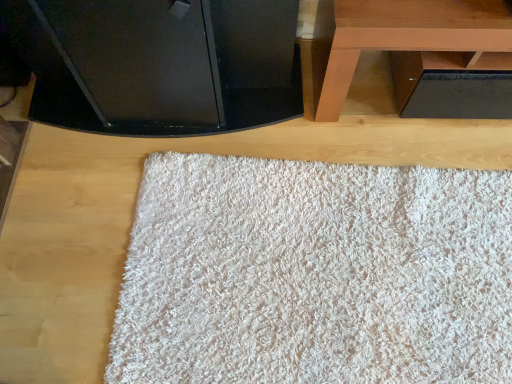
You are a GUI agent. You are given a task and a screenshot of the screen. Output one action in this format:
    pyautogui.click(x=<x>, y=<y>)
    Task: Click on the free location in front of black glossy tv at upper center
    The height and width of the screenshot is (384, 512).
    Given the screenshot: What is the action you would take?
    pyautogui.click(x=82, y=238)